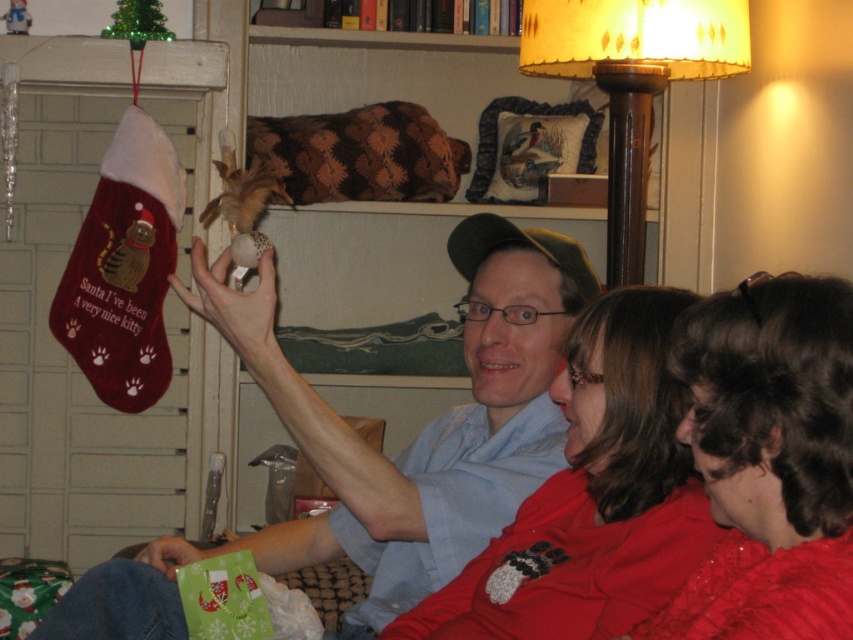
Based on the photo, is matte red sweater at center to the left of wooden floor lamp at upper right from the viewer's perspective?

Indeed, matte red sweater at center is positioned on the left side of wooden floor lamp at upper right.

Is matte red sweater at center shorter than wooden floor lamp at upper right?

Yes.

Is point (611, 413) less distant than point (607, 38)?

Yes, it is.

The height and width of the screenshot is (640, 853). In order to click on matte red sweater at center in this screenshot , I will do `click(592, 497)`.

Is matte fabric stocking at left below shiny red blouse at lower right?

Actually, matte fabric stocking at left is above shiny red blouse at lower right.

Is matte fabric stocking at left taller than shiny red blouse at lower right?

Yes.

Image resolution: width=853 pixels, height=640 pixels. Describe the element at coordinates (376, 451) in the screenshot. I see `matte fabric stocking at left` at that location.

Identify the location of matte fabric stocking at left. (376, 451).

Between point (750, 472) and point (628, 26), which one is positioned in front?

Point (750, 472)

Is shiny red blouse at lower right positioned in front of wooden floor lamp at upper right?

Yes, shiny red blouse at lower right is in front of wooden floor lamp at upper right.

This screenshot has height=640, width=853. I want to click on shiny red blouse at lower right, so click(770, 460).

Identify the location of shiny red blouse at lower right. The height and width of the screenshot is (640, 853). coord(770,460).